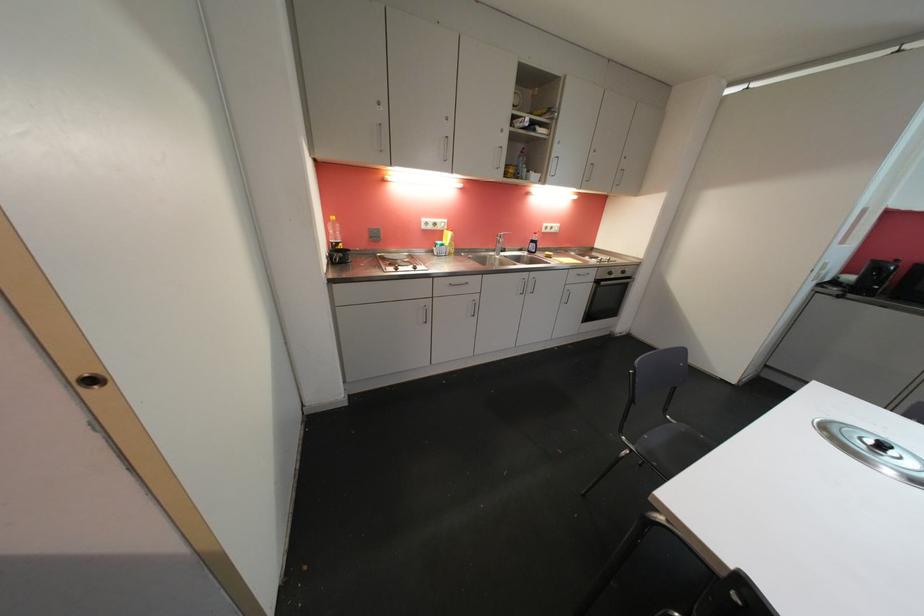
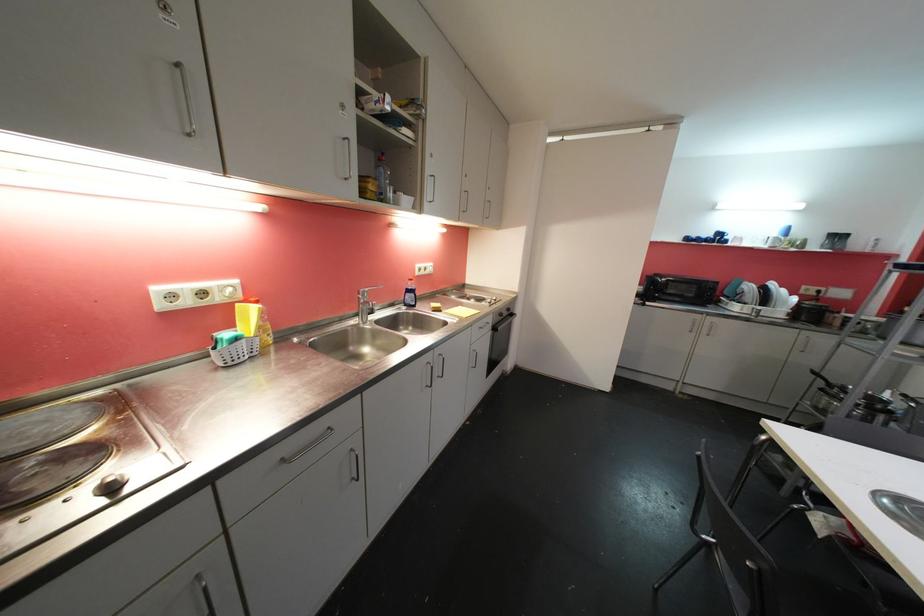
Question: The camera is either moving clockwise (left) or counter-clockwise (right) around the object. The first image is from the beginning of the video and the second image is from the end. Is the camera moving left or right when shooting the video?

Choices:
 (A) Left
 (B) Right

Answer: (A)